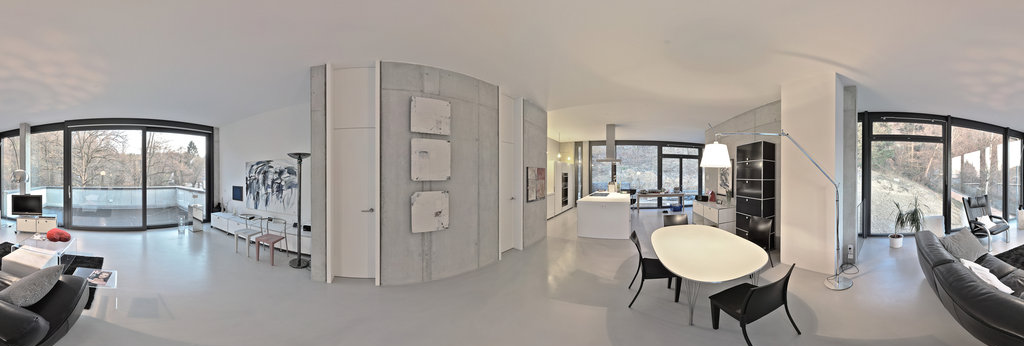
Image resolution: width=1024 pixels, height=346 pixels. What are the coordinates of `window` in the screenshot? It's located at (908, 179).